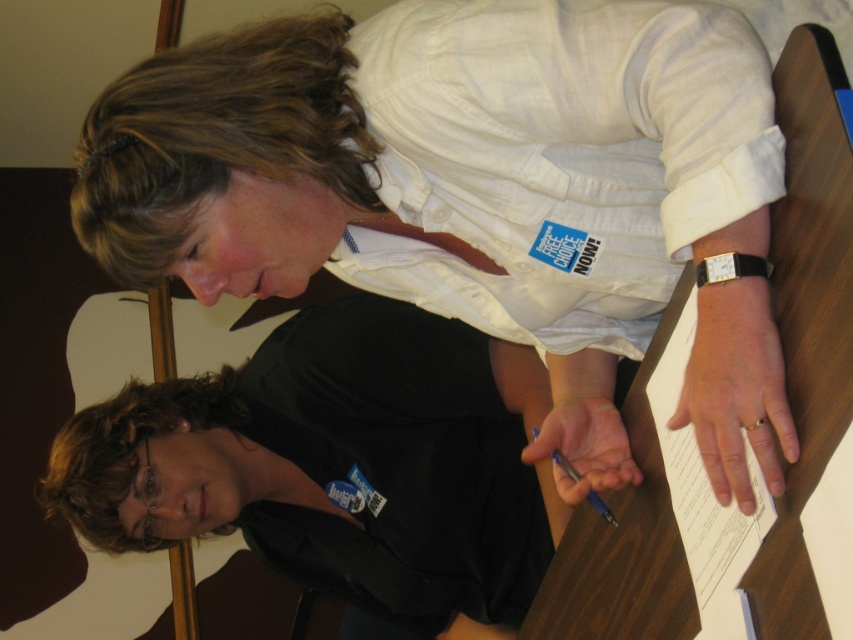
Does black matte shirt at center have a smaller size compared to white paper at right?

Actually, black matte shirt at center might be larger than white paper at right.

Who is more distant from viewer, (480,525) or (660,368)?

Point (480,525)

At what (x,y) coordinates should I click in order to perform the action: click on black matte shirt at center. Please return your answer as a coordinate pair (x, y). Image resolution: width=853 pixels, height=640 pixels. Looking at the image, I should click on (338, 465).

Who is taller, wooden table at center or blue metallic pen at lower center?

Standing taller between the two is wooden table at center.

Which is behind, point (595, 596) or point (553, 451)?

The point (553, 451) is more distant.

Is point (773, 84) more distant than point (554, 458)?

No.

Locate an element on the screen. This screenshot has height=640, width=853. wooden table at center is located at coordinates (808, 316).

Can you confirm if white cotton shirt at upper center is positioned to the right of black matte shirt at center?

Indeed, white cotton shirt at upper center is positioned on the right side of black matte shirt at center.

Is white cotton shirt at upper center taller than black matte shirt at center?

Incorrect, white cotton shirt at upper center's height is not larger of black matte shirt at center's.

The width and height of the screenshot is (853, 640). What do you see at coordinates (556, 157) in the screenshot?
I see `white cotton shirt at upper center` at bounding box center [556, 157].

This screenshot has height=640, width=853. In order to click on white cotton shirt at upper center in this screenshot , I will do `click(556, 157)`.